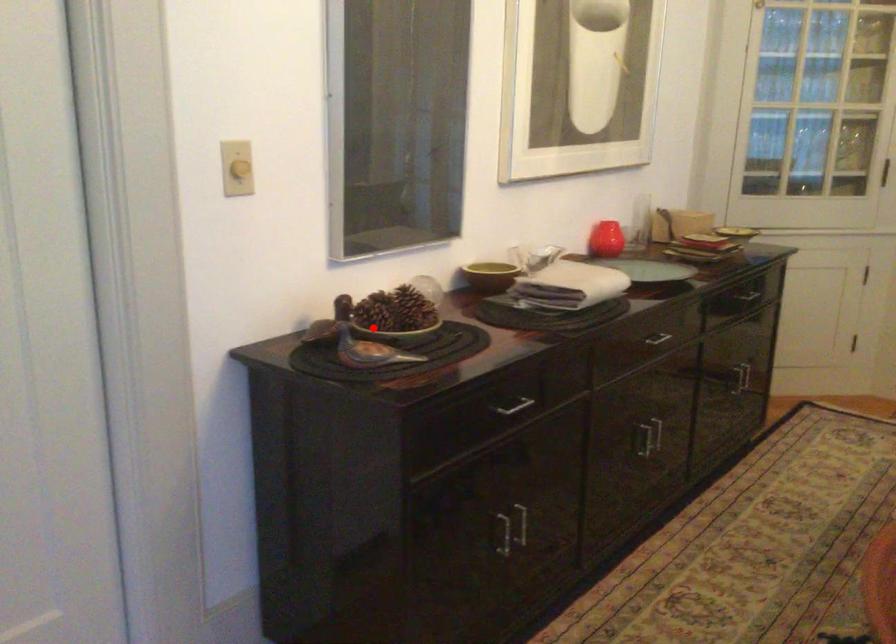
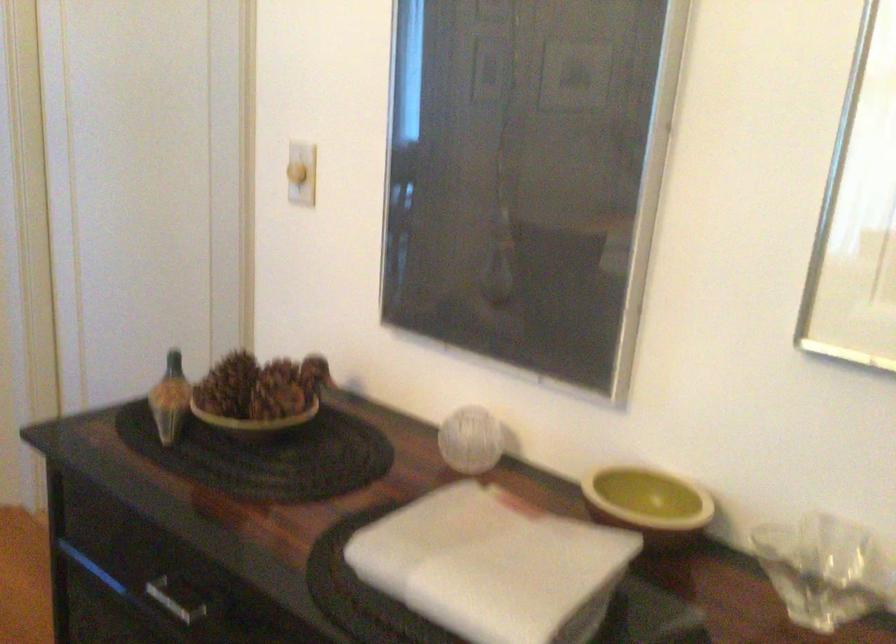
In the second image, find the point that corresponds to the highlighted location in the first image.

(169, 399)